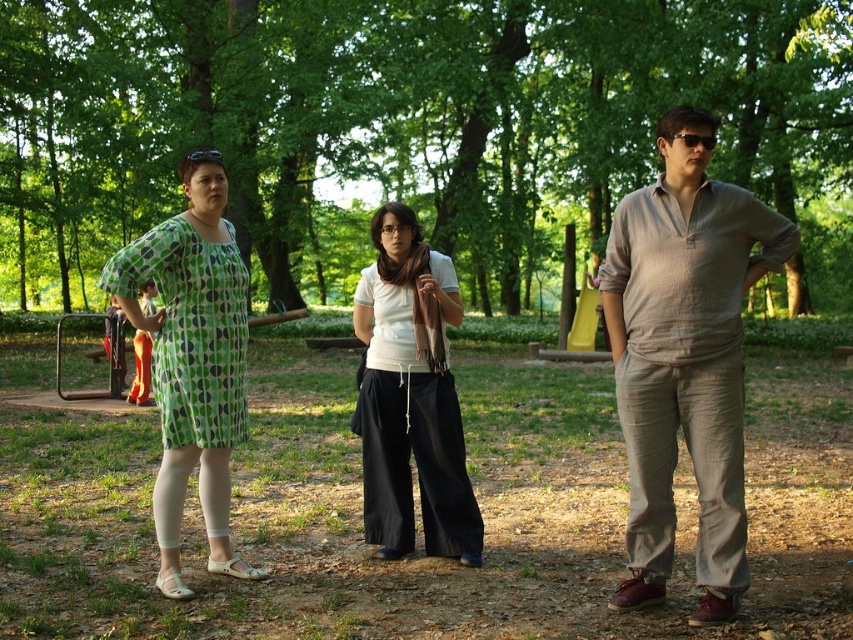
Question: Does matte green dress at center have a lesser width compared to light brown linen shirt at right?

Choices:
 (A) no
 (B) yes

Answer: (A)

Question: Where is matte green dress at center located in relation to green dotted dress at left in the image?

Choices:
 (A) above
 (B) below

Answer: (B)

Question: Is matte green dress at center below white cotton shirt at center?

Choices:
 (A) yes
 (B) no

Answer: (A)

Question: Which point appears closest to the camera in this image?

Choices:
 (A) (601, 513)
 (B) (772, 88)
 (C) (671, 188)
 (D) (201, 307)

Answer: (C)

Question: Based on their relative distances, which object is farther from the green leafy tree at center?

Choices:
 (A) green dotted dress at left
 (B) light brown linen shirt at right
 (C) matte green dress at center

Answer: (B)

Question: Among these objects, which one is farthest from the camera?

Choices:
 (A) white cotton shirt at center
 (B) light brown linen shirt at right
 (C) green dotted dress at left

Answer: (A)